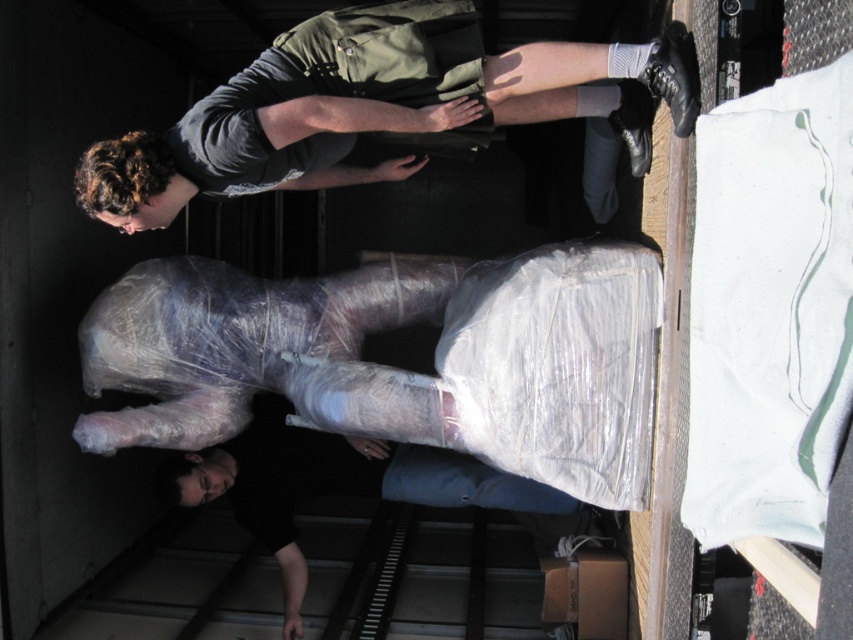
Question: Can you confirm if dark gray t-shirt at upper center is wider than black matte shirt at lower center?

Choices:
 (A) yes
 (B) no

Answer: (B)

Question: Does dark gray t-shirt at upper center have a greater width compared to black matte shirt at lower center?

Choices:
 (A) yes
 (B) no

Answer: (B)

Question: Which point is farther to the camera?

Choices:
 (A) black matte shirt at lower center
 (B) dark gray t-shirt at upper center

Answer: (A)

Question: Among these objects, which one is nearest to the camera?

Choices:
 (A) black matte shirt at lower center
 (B) dark gray t-shirt at upper center

Answer: (B)

Question: Does dark gray t-shirt at upper center have a larger size compared to black matte shirt at lower center?

Choices:
 (A) yes
 (B) no

Answer: (A)